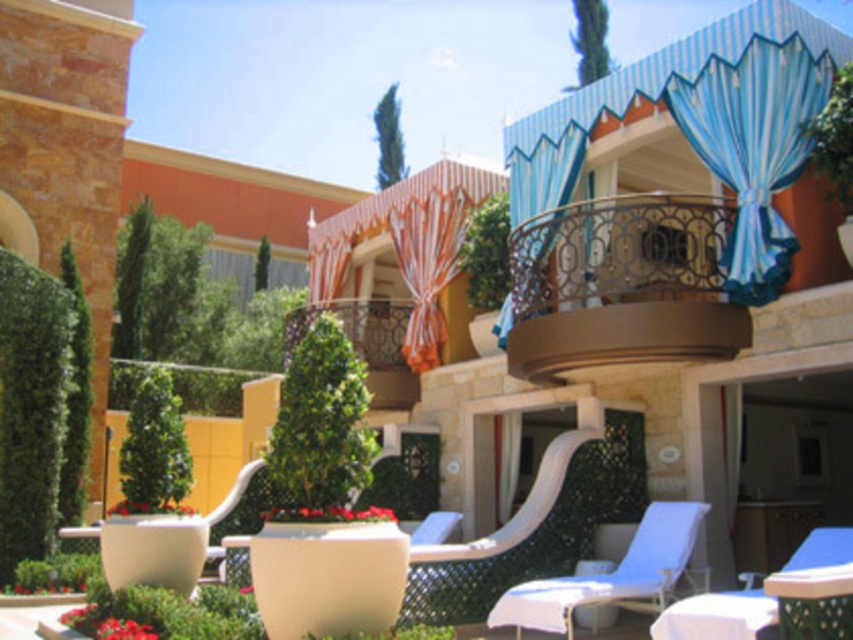
Which of these two, gold wrought iron balcony at upper center or green leafy plant at center, stands shorter?

Standing shorter between the two is green leafy plant at center.

Does gold wrought iron balcony at upper center have a greater height compared to green leafy plant at center?

Yes, gold wrought iron balcony at upper center is taller than green leafy plant at center.

Which is behind, point (645, 310) or point (154, 502)?

Positioned behind is point (154, 502).

Locate an element on the screen. The height and width of the screenshot is (640, 853). gold wrought iron balcony at upper center is located at coordinates (621, 285).

Does gold wrought iron balcony at upper center have a lesser height compared to blue striped curtain at upper right?

No, gold wrought iron balcony at upper center is not shorter than blue striped curtain at upper right.

In the scene shown: Does gold wrought iron balcony at upper center appear under blue striped curtain at upper right?

No.

Measure the distance between point (577, 310) and camera.

Point (577, 310) and camera are 28.81 meters apart from each other.

I want to click on gold wrought iron balcony at upper center, so click(x=621, y=285).

Is red matte flower at center below green leafy plant at center?

Yes, red matte flower at center is below green leafy plant at center.

Does point (339, 520) come behind point (178, 513)?

No.

This screenshot has width=853, height=640. In order to click on red matte flower at center in this screenshot , I will do `click(328, 515)`.

Image resolution: width=853 pixels, height=640 pixels. I want to click on red matte flower at center, so click(328, 515).